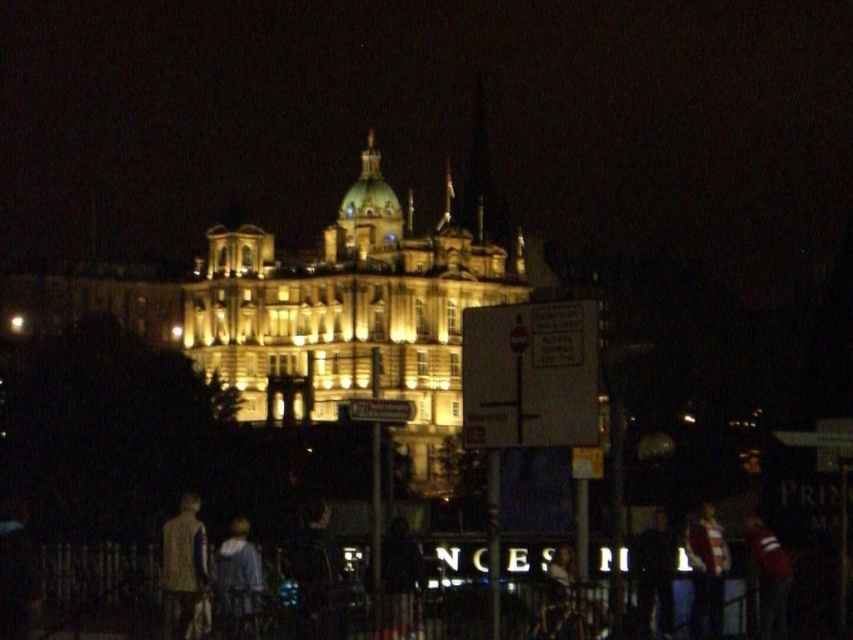
This screenshot has width=853, height=640. What do you see at coordinates (706, 572) in the screenshot?
I see `striped jersey at lower right` at bounding box center [706, 572].

Does striped jersey at lower right come in front of dark blue jeans at lower right?

No.

Who is more distant from viewer, (x=723, y=536) or (x=637, y=566)?

Positioned behind is point (x=723, y=536).

Find the location of `striped jersey at lower right`. striped jersey at lower right is located at coordinates (706, 572).

Is light blue fabric shirt at center to the left of striped jersey at lower right from the viewer's perspective?

Yes, light blue fabric shirt at center is to the left of striped jersey at lower right.

Between light blue fabric shirt at center and striped jersey at lower right, which one has more height?

striped jersey at lower right

Is point (231, 552) more distant than point (720, 632)?

No, (231, 552) is in front of (720, 632).

The image size is (853, 640). Identify the location of light blue fabric shirt at center. (238, 580).

Does dark blue jacket at lower center appear over light brown fabric jacket at lower left?

Incorrect, dark blue jacket at lower center is not positioned above light brown fabric jacket at lower left.

Who is lower down, dark blue jacket at lower center or light brown fabric jacket at lower left?

dark blue jacket at lower center is lower down.

Which is behind, point (321, 604) or point (192, 573)?

Point (192, 573)

The height and width of the screenshot is (640, 853). I want to click on dark blue jacket at lower center, so click(x=317, y=577).